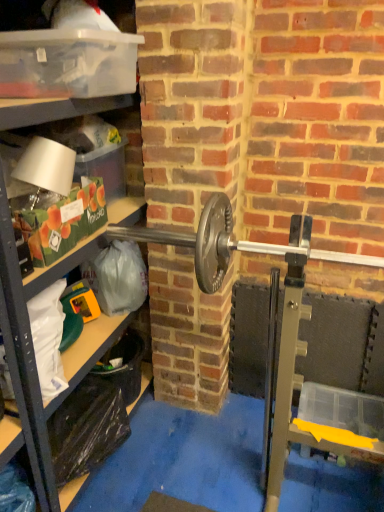
Question: Does point (77, 256) appear closer or farther from the camera than point (48, 44)?

Choices:
 (A) farther
 (B) closer

Answer: (A)

Question: In terms of height, does clear plastic shelf at left look taller or shorter compared to transparent plastic container at upper left?

Choices:
 (A) tall
 (B) short

Answer: (A)

Question: Looking at their shapes, would you say clear plastic shelf at left is wider or thinner than transparent plastic container at upper left?

Choices:
 (A) thin
 (B) wide

Answer: (A)

Question: In terms of height, does transparent plastic container at upper left look taller or shorter compared to clear plastic shelf at left?

Choices:
 (A) tall
 (B) short

Answer: (B)

Question: From the image's perspective, relative to clear plastic shelf at left, is transparent plastic container at upper left above or below?

Choices:
 (A) above
 (B) below

Answer: (A)

Question: In terms of width, does transparent plastic container at upper left look wider or thinner when compared to clear plastic shelf at left?

Choices:
 (A) wide
 (B) thin

Answer: (A)

Question: Which is correct: transparent plastic container at upper left is inside clear plastic shelf at left, or outside of it?

Choices:
 (A) inside
 (B) outside

Answer: (A)